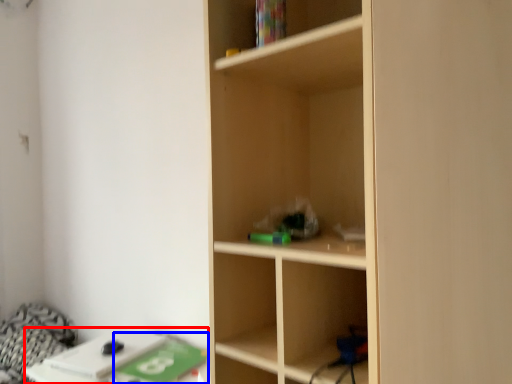
Question: Among these objects, which one is nearest to the camera, table (highlighted by a red box) or paperback book (highlighted by a blue box)?

Choices:
 (A) table
 (B) paperback book

Answer: (B)